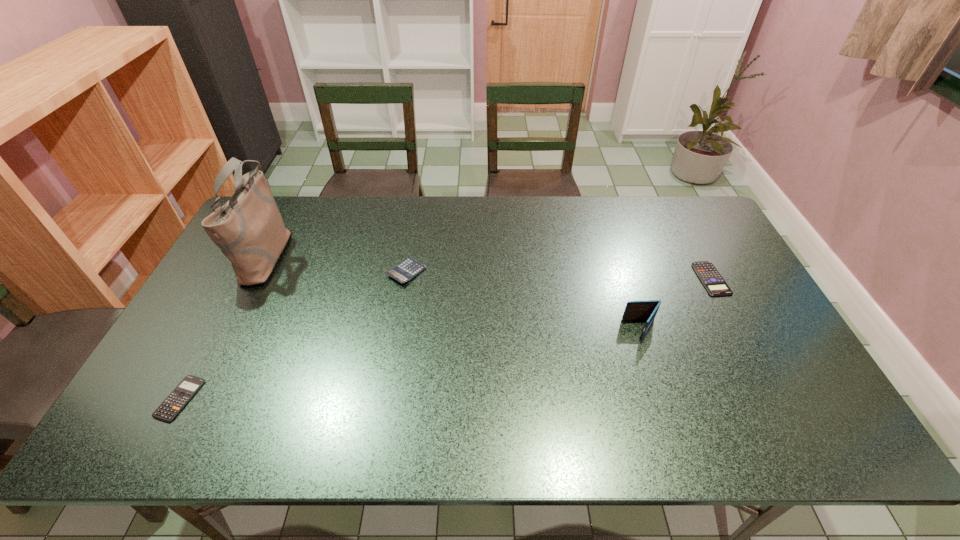
Where is `object present at the right edge`? This screenshot has width=960, height=540. object present at the right edge is located at coordinates pyautogui.click(x=712, y=280).

In order to click on object that is at the far left corner in this screenshot , I will do tap(249, 230).

What are the coordinates of `object that is at the near left corner` in the screenshot? It's located at (186, 389).

Where is `vacant space at the far edge of the desktop`? vacant space at the far edge of the desktop is located at coordinates (466, 223).

The width and height of the screenshot is (960, 540). Find the location of `free space at the near edge of the desktop`. free space at the near edge of the desktop is located at coordinates pyautogui.click(x=326, y=423).

In order to click on free space at the left edge of the desktop in this screenshot , I will do `click(263, 289)`.

In the image, there is a desktop. Where is `free space at the right edge`? Image resolution: width=960 pixels, height=540 pixels. free space at the right edge is located at coordinates (705, 287).

This screenshot has width=960, height=540. In order to click on free space at the near right corner of the desktop in this screenshot , I will do `click(810, 445)`.

Find the location of `free area in between the fourth farthest object and the nearest object`. free area in between the fourth farthest object and the nearest object is located at coordinates tap(411, 363).

Where is `free point between the nearest object and the tallest object`? free point between the nearest object and the tallest object is located at coordinates (224, 326).